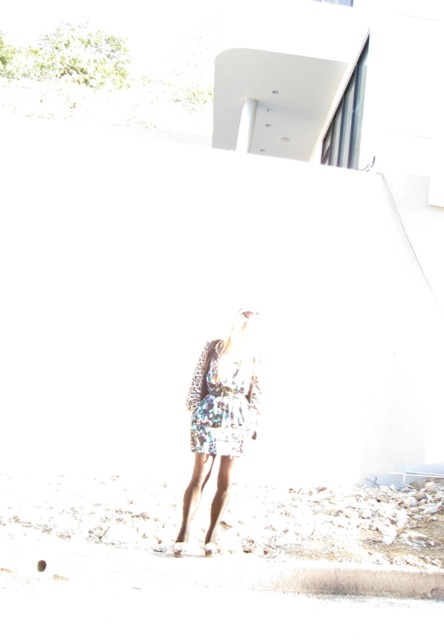
You are planning to take a photo of the floral dress at center and the white sandy beach at lower center. Based on their positions, which one would appear closer to the camera?

The floral dress at center appears closer to the camera because it is taller than the white sandy beach at lower center, indicating it is positioned in front.

You are a photographer planning to capture the scene with the white sandy beach at lower center and the floral fabric dress at center. Which object occupies more horizontal space in the image?

The white sandy beach at lower center occupies more horizontal space than the floral fabric dress at center because its width surpasses the dress.

You are a photographer trying to capture a photo of the person wearing the floral dress at center and the floral fabric dress at center. Which dress should you focus on if you want to capture the one on the left side?

The floral dress at center is positioned on the left side of the floral fabric dress at center, so you should focus on the floral dress at center to capture the one on the left.